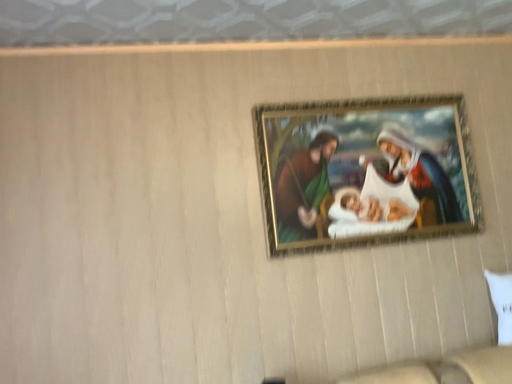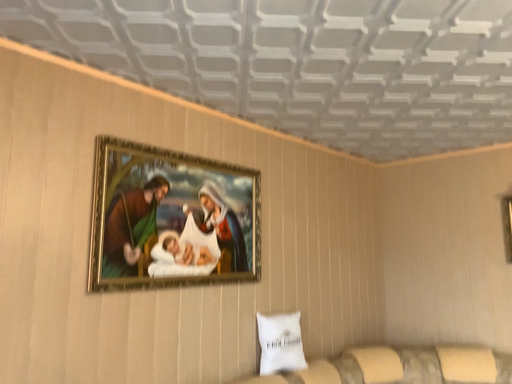
Question: Which way did the camera rotate in the video?

Choices:
 (A) rotated left
 (B) rotated right

Answer: (B)